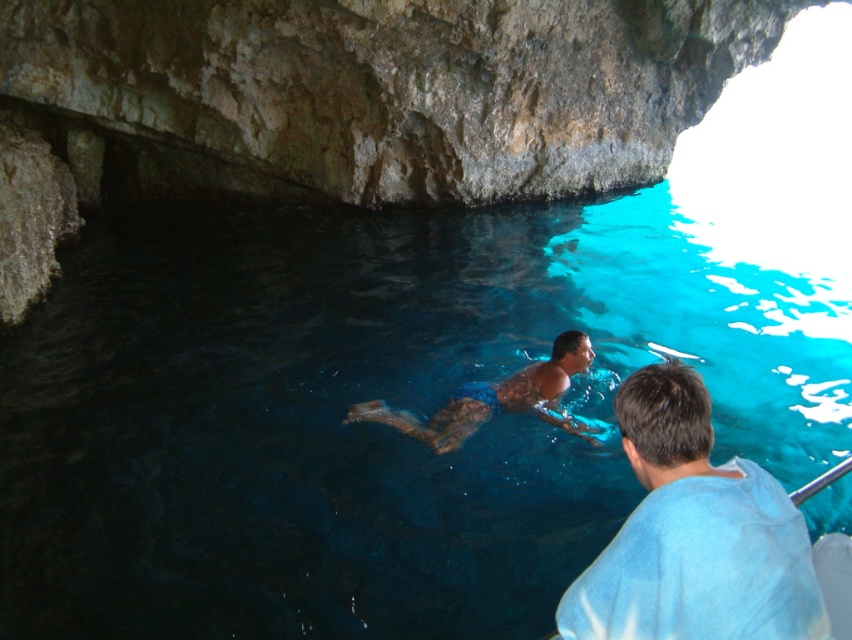
Question: Does clear blue water at center come in front of camouflage swim trunks at center?

Choices:
 (A) no
 (B) yes

Answer: (B)

Question: Is smooth skin man at center thinner than camouflage swim trunks at center?

Choices:
 (A) yes
 (B) no

Answer: (A)

Question: Is clear blue water at center positioned behind camouflage swim trunks at center?

Choices:
 (A) no
 (B) yes

Answer: (A)

Question: Which point is closer to the camera?

Choices:
 (A) camouflage swim trunks at center
 (B) smooth skin man at center
 (C) clear blue water at center

Answer: (B)

Question: Estimate the real-world distances between objects in this image. Which object is farther from the smooth skin man at center?

Choices:
 (A) clear blue water at center
 (B) camouflage swim trunks at center

Answer: (A)

Question: Which point appears farthest from the camera in this image?

Choices:
 (A) (429, 362)
 (B) (462, 435)
 (C) (813, 573)

Answer: (A)